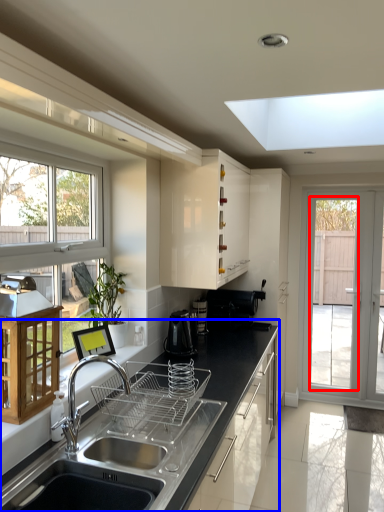
Question: Which point is further to the camera, screen door (highlighted by a red box) or countertop (highlighted by a blue box)?

Choices:
 (A) screen door
 (B) countertop

Answer: (A)